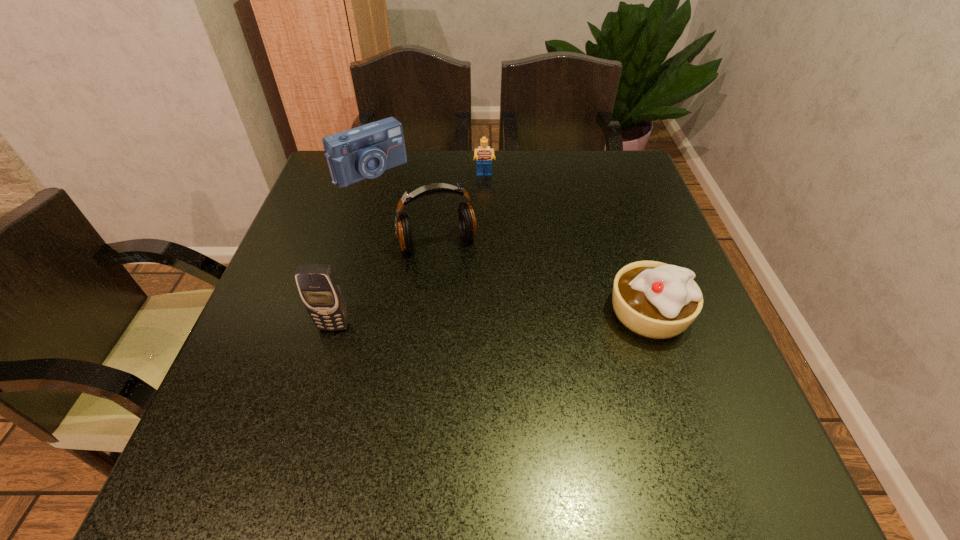
The width and height of the screenshot is (960, 540). Find the location of `free point between the Lego and the camera`. free point between the Lego and the camera is located at coordinates (427, 174).

This screenshot has width=960, height=540. Find the location of `blank region between the cellular telephone and the third farthest object`. blank region between the cellular telephone and the third farthest object is located at coordinates (386, 285).

Select which object is the third closest to the cellular telephone. Please provide its 2D coordinates. Your answer should be formatted as a tuple, i.e. [(x, y)], where the tuple contains the x and y coordinates of a point satisfying the conditions above.

[(653, 299)]

The height and width of the screenshot is (540, 960). I want to click on object that ranks as the third closest to the headset, so click(x=484, y=154).